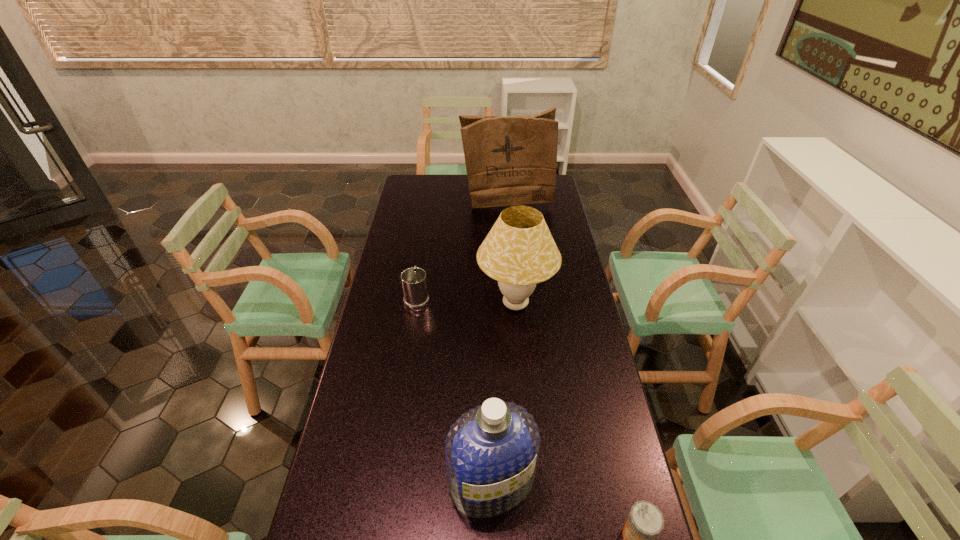
Identify which object is the second closest to the fourth tallest object. Please provide its 2D coordinates. Your answer should be formatted as a tuple, i.e. [(x, y)], where the tuple contains the x and y coordinates of a point satisfying the conditions above.

[(509, 160)]

Locate an element on the screen. the second closest object to the leftmost object is located at coordinates (509, 160).